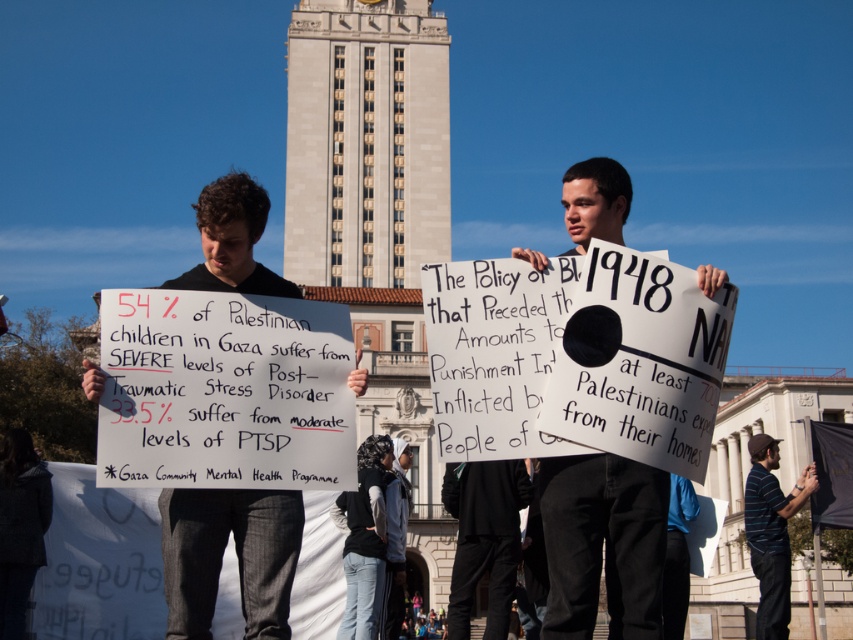
You are a photographer standing 10 meters away from the protest scene. You want to take a photo that includes both the white paper sign at center and the black fabric shirt at center. Can you position yourself so that both objects are within the frame of your camera, which has a maximum field of view of 12 meters? Please explain your reasoning.

The white paper sign at center and the black fabric shirt at center are 13.53 meters apart. Since the camera has a maximum field of view of 12 meters, the distance between the two objects exceeds the camera field of view. Therefore, it is not possible to capture both objects within the frame simultaneously.